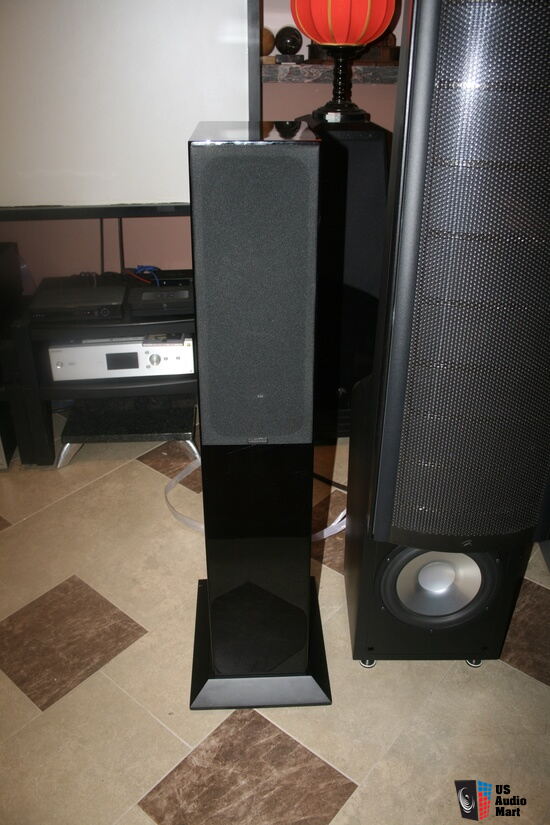
Identify the location of black cord. This screenshot has width=550, height=825. (341, 483).